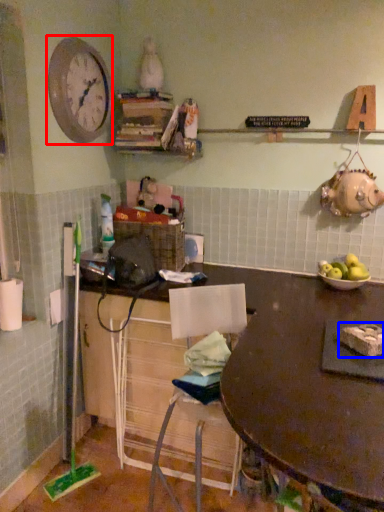
Question: Which point is further to the camera, clock (highlighted by a red box) or food (highlighted by a blue box)?

Choices:
 (A) clock
 (B) food

Answer: (A)